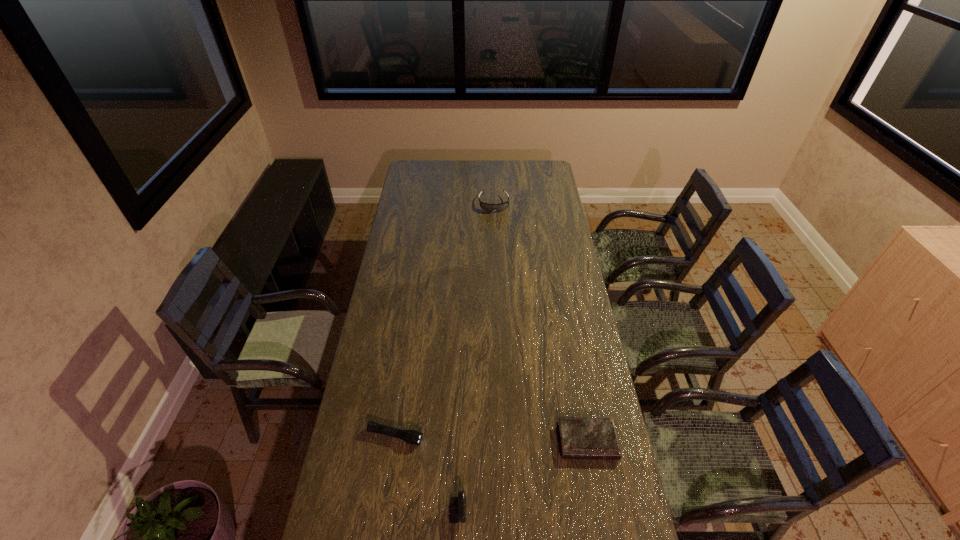
Where is `webcam`? The height and width of the screenshot is (540, 960). webcam is located at coordinates (457, 509).

Locate an element on the screen. diary is located at coordinates (580, 438).

I want to click on the shortest object, so click(580, 438).

Image resolution: width=960 pixels, height=540 pixels. Identify the location of flashlight. (412, 437).

This screenshot has height=540, width=960. I want to click on the farthest object, so click(487, 207).

Image resolution: width=960 pixels, height=540 pixels. I want to click on goggles, so click(x=487, y=207).

Identify the location of free space located on the front-facing side of the nearest object. (571, 516).

Identify the location of free location located on the left of the shortest object. Image resolution: width=960 pixels, height=540 pixels. (543, 441).

You are a GUI agent. You are given a task and a screenshot of the screen. Output one action in this format:
    pyautogui.click(x=<x>, y=<y>)
    Task: Click on the vacant space located 0.250m at the lens end of the flashlight
    Image resolution: width=960 pixels, height=540 pixels.
    Given the screenshot: What is the action you would take?
    pyautogui.click(x=495, y=457)

Image resolution: width=960 pixels, height=540 pixels. Identify the location of vacant position located at the lens end of the flashlight. (499, 458).